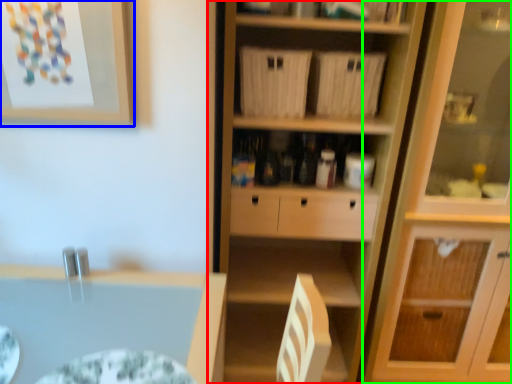
Question: Which object is positioned farthest from cupboard (highlighted by a red box)? Select from picture frame (highlighted by a blue box) and cabinetry (highlighted by a green box).

Choices:
 (A) picture frame
 (B) cabinetry

Answer: (A)